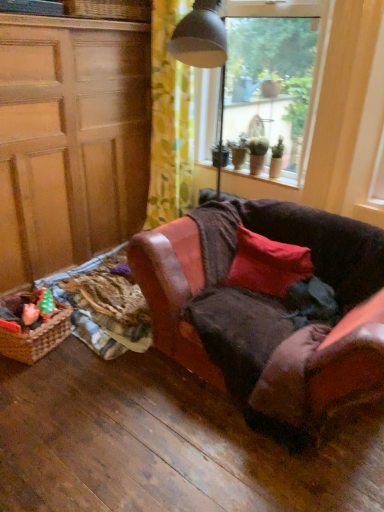
You are a GUI agent. You are given a task and a screenshot of the screen. Output one action in this format:
    pyautogui.click(x=<x>, y=<y>)
    Task: Click on the blank space situated above woven brown picnic basket at lower left (from a real-world perspective)
    The height and width of the screenshot is (512, 384).
    Given the screenshot: What is the action you would take?
    pyautogui.click(x=22, y=313)